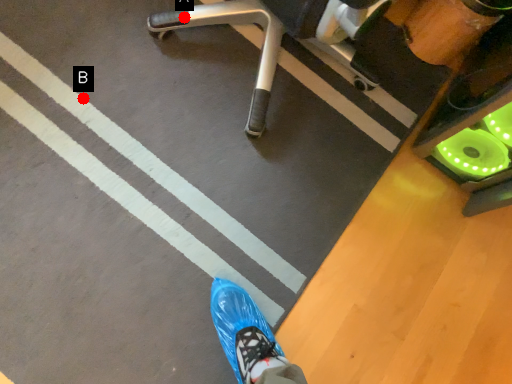
Question: Two points are circled on the image, labeled by A and B beside each circle. Which of the following is the farthest from the observer?

Choices:
 (A) A is further
 (B) B is further

Answer: (A)